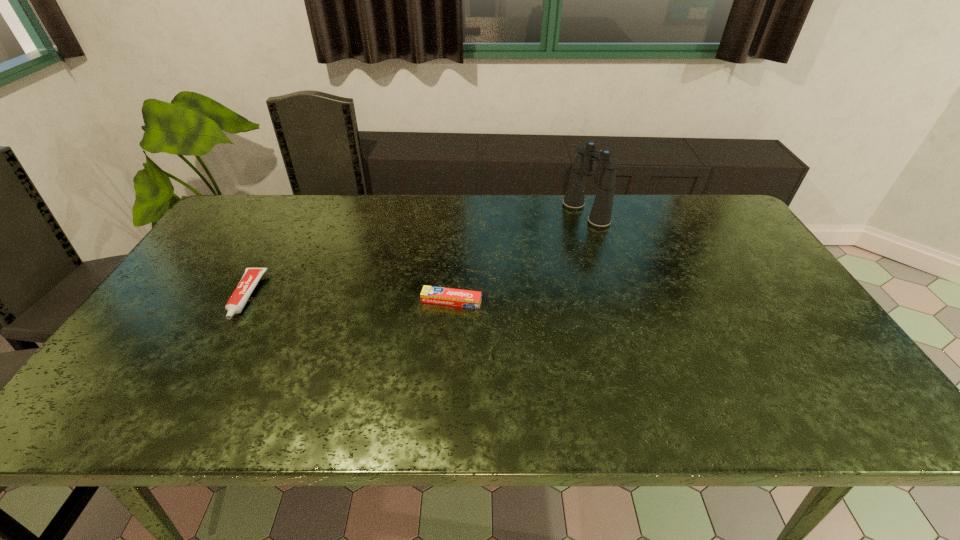
Identify the location of binoculars. Image resolution: width=960 pixels, height=540 pixels. (600, 216).

Locate an element on the screen. The width and height of the screenshot is (960, 540). the rightmost object is located at coordinates (600, 216).

You are a GUI agent. You are given a task and a screenshot of the screen. Output one action in this format:
    pyautogui.click(x=<x>, y=<y>)
    Task: Click on the leftmost object
    The image size is (960, 540).
    Given the screenshot: What is the action you would take?
    pyautogui.click(x=251, y=276)

In order to click on the taller toothpaste in this screenshot , I will do `click(251, 276)`.

The height and width of the screenshot is (540, 960). Identify the location of the shortest object. (430, 294).

This screenshot has width=960, height=540. I want to click on the right toothpaste, so click(x=430, y=294).

This screenshot has height=540, width=960. In order to click on free region located on the front of the rightmost object in this screenshot , I will do `click(617, 313)`.

Identify the location of vacant space located at the nozzle of the leftmost object. Image resolution: width=960 pixels, height=540 pixels. (188, 399).

Find the location of a particular element. The image size is (960, 540). free point located 0.360m on the right of the shortest object is located at coordinates (617, 301).

Image resolution: width=960 pixels, height=540 pixels. I want to click on object that is at the far edge, so click(x=600, y=216).